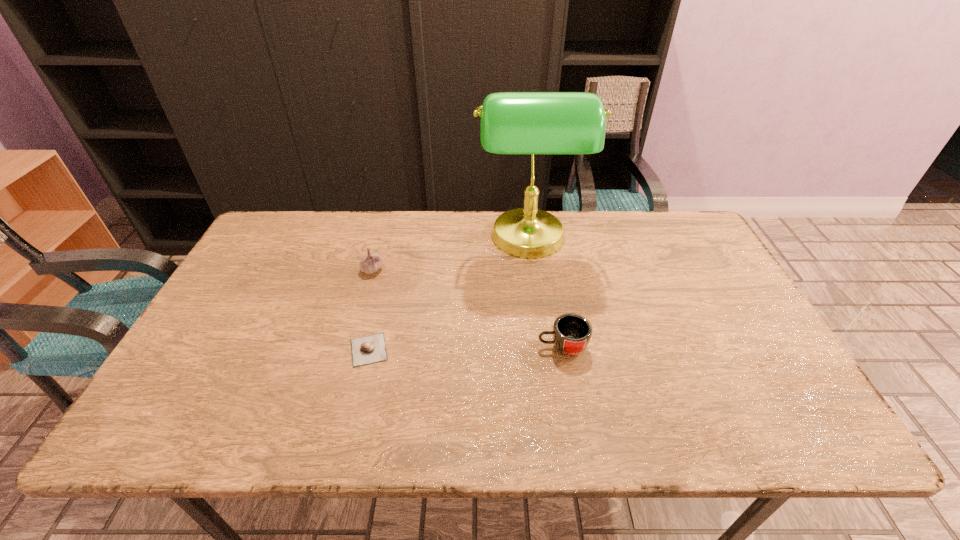
You are a GUI agent. You are given a task and a screenshot of the screen. Output one action in this format:
    pyautogui.click(x=<x>, y=<y>)
    Task: Click on the vacant position located on the side of the mug with the handle
    
    Given the screenshot: What is the action you would take?
    pos(385,347)

The image size is (960, 540). I want to click on vacant space situated on the side of the mug with the handle, so click(x=473, y=347).

The width and height of the screenshot is (960, 540). I want to click on blank area located on the left of the shorter garlic, so click(234, 349).

This screenshot has width=960, height=540. In order to click on object that is at the far edge in this screenshot , I will do `click(532, 123)`.

Find the location of a particular element. This screenshot has width=960, height=540. free space at the far edge of the desktop is located at coordinates [x=568, y=212].

In the image, there is a desktop. At what (x,y) coordinates should I click in order to perform the action: click on free space at the near edge. Please return your answer as a coordinate pair (x, y). The image size is (960, 540). Looking at the image, I should click on (731, 430).

Where is `vacant position at the left edge of the desktop`? Image resolution: width=960 pixels, height=540 pixels. vacant position at the left edge of the desktop is located at coordinates (236, 313).

You are a GUI agent. You are given a task and a screenshot of the screen. Output one action in this format:
    pyautogui.click(x=<x>, y=<y>)
    Task: Click on the vacant space at the right edge of the desktop
    The height and width of the screenshot is (540, 960).
    Given the screenshot: What is the action you would take?
    pyautogui.click(x=680, y=256)

In the image, there is a desktop. In order to click on vacant space at the near left corner in this screenshot , I will do `click(203, 440)`.

The width and height of the screenshot is (960, 540). In order to click on vacant region between the nearer garlic and the taller garlic in this screenshot , I will do `click(371, 309)`.